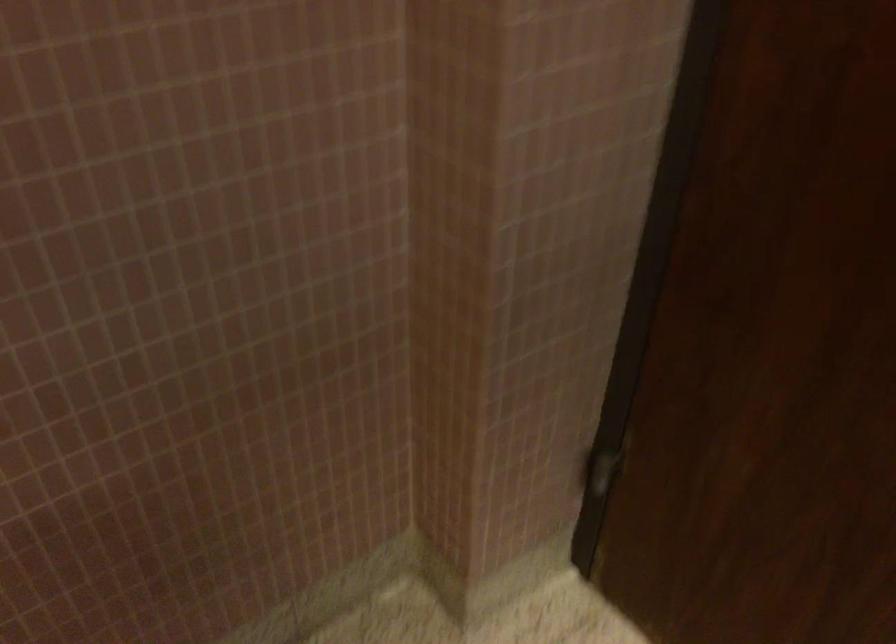
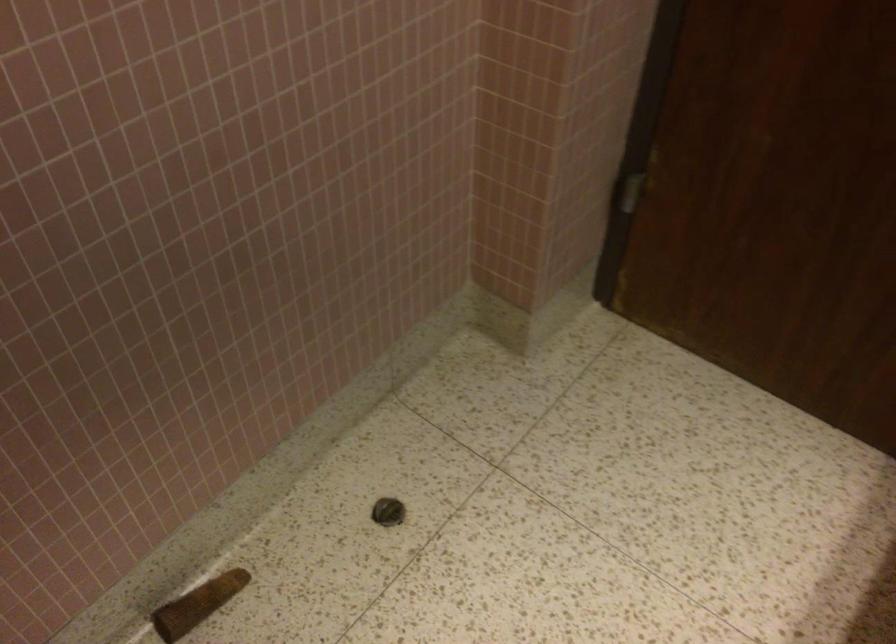
In a continuous first-person perspective shot, in which direction is the camera moving?

The cameraman walked toward left, backward.